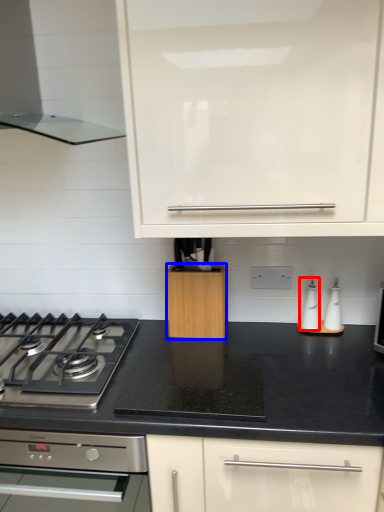
Question: Which object appears farthest to the camera in this image, appliance (highlighted by a red box) or kitchen appliance (highlighted by a blue box)?

Choices:
 (A) appliance
 (B) kitchen appliance

Answer: (A)